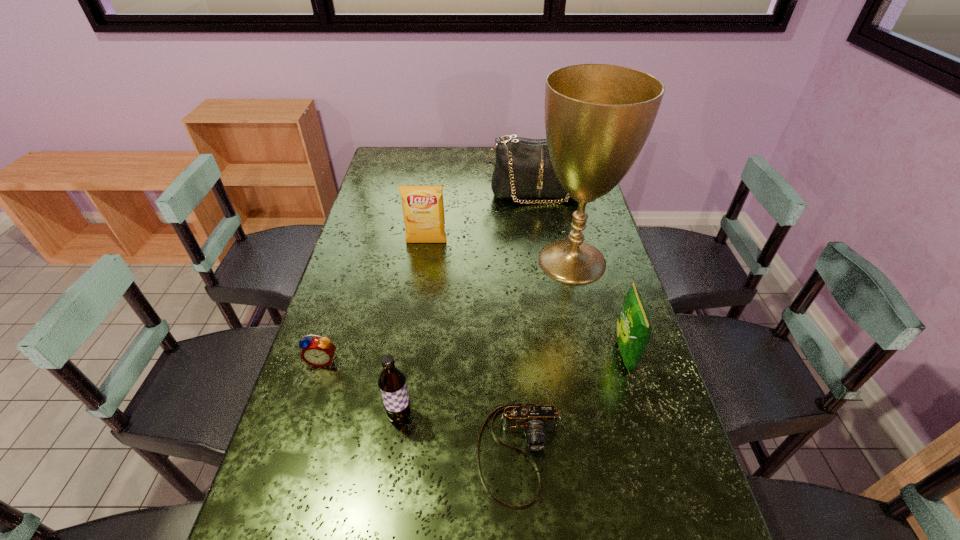
This screenshot has height=540, width=960. In order to click on vacant area in the image that satisfies the following two spatial constraints: 1. on the front of the farther crisp (potato chip) with the logo; 2. on the right side of the tallest object in this screenshot , I will do `click(424, 261)`.